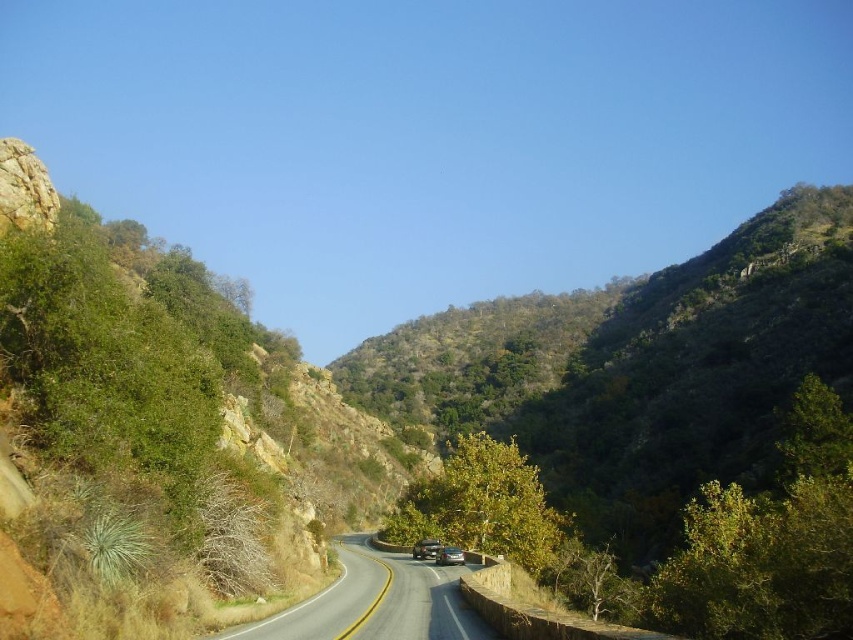
Is black asphalt road at center further to camera compared to shiny silver sedan at center?

That is False.

Does black asphalt road at center appear under shiny silver sedan at center?

No.

The width and height of the screenshot is (853, 640). Find the location of `black asphalt road at center`. black asphalt road at center is located at coordinates (376, 602).

Identify the location of black asphalt road at center. (376, 602).